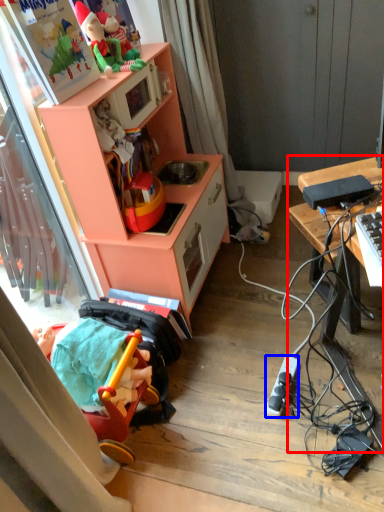
Question: Which of the following is the farthest to the observer, desk (highlighted by a red box) or appliance (highlighted by a blue box)?

Choices:
 (A) desk
 (B) appliance

Answer: (B)